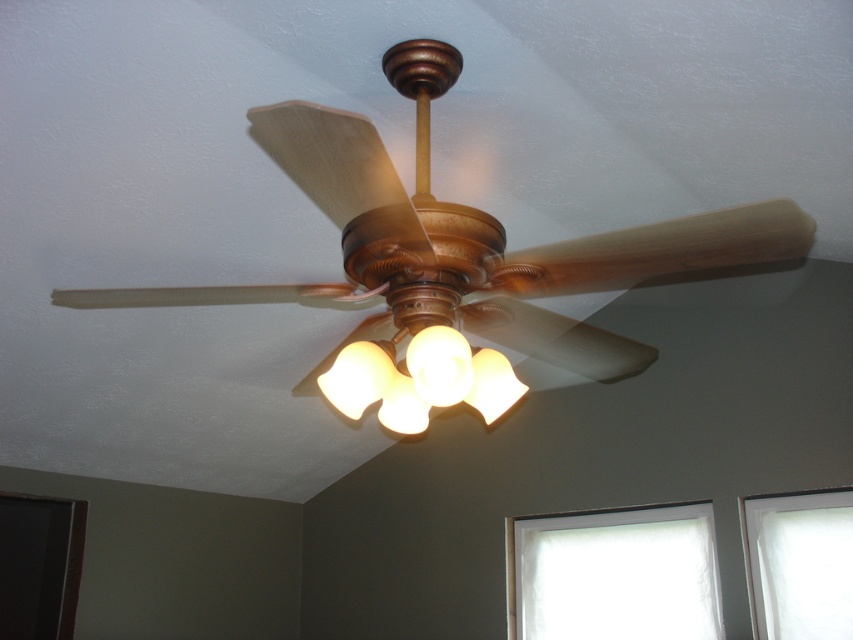
You are an interior designer assessing the room layout. You need to install a new air purifier that requires 1.2 meters of space around it to function properly. Given the wooden ceiling fan at center and the translucent frosted glass light fixture at center, which object would you consider in terms of clearance requirements?

The wooden ceiling fan at center has a larger size compared to the translucent frosted glass light fixture at center, so you should consider the clearance requirements around the wooden ceiling fan at center to ensure the air purifier has enough space.

You are an interior designer planning to install a new ceiling fan and light fixture in a room with a low ceiling. The wooden ceiling fan at center and the translucent frosted glass light fixture at center are options. Given the height difference between them, which one would you recommend to avoid hitting the ceiling?

The translucent frosted glass light fixture at center is shorter than the wooden ceiling fan at center, so it would be the better choice to avoid hitting the ceiling in a low ceiling room.